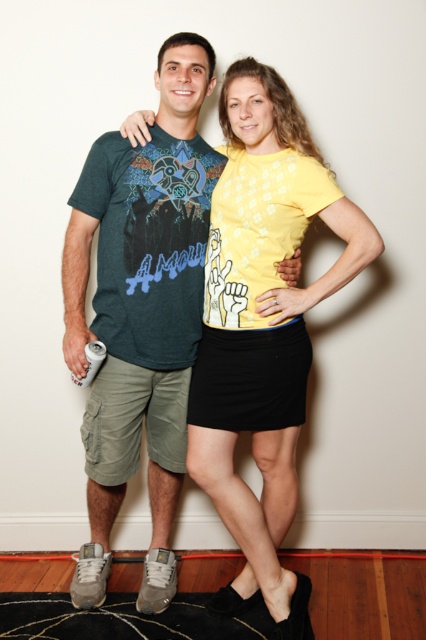
Question: Which object is positioned closest to the black textured rug at lower center?

Choices:
 (A) matte green t-shirt at center
 (B) yellow matte t-shirt at center

Answer: (A)

Question: Is matte green t-shirt at center positioned behind black textured rug at lower center?

Choices:
 (A) no
 (B) yes

Answer: (B)

Question: Which object is the farthest from the matte green t-shirt at center?

Choices:
 (A) black textured rug at lower center
 (B) yellow matte t-shirt at center

Answer: (A)

Question: Which object is positioned closest to the yellow matte t-shirt at center?

Choices:
 (A) matte green t-shirt at center
 (B) black textured rug at lower center

Answer: (A)

Question: Where is matte green t-shirt at center located in relation to yellow matte t-shirt at center in the image?

Choices:
 (A) left
 (B) right

Answer: (A)

Question: Where is matte green t-shirt at center located in relation to yellow matte t-shirt at center in the image?

Choices:
 (A) below
 (B) above

Answer: (B)